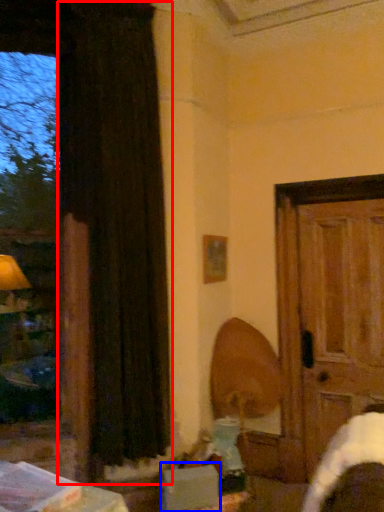
Question: Which object appears closest to the camera in this image, curtain (highlighted by a red box) or cardboard box (highlighted by a blue box)?

Choices:
 (A) curtain
 (B) cardboard box

Answer: (B)